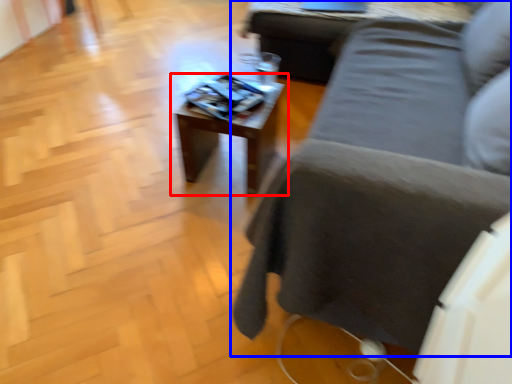
Question: Which object is closer to the camera taking this photo, table (highlighted by a red box) or studio couch (highlighted by a blue box)?

Choices:
 (A) table
 (B) studio couch

Answer: (B)